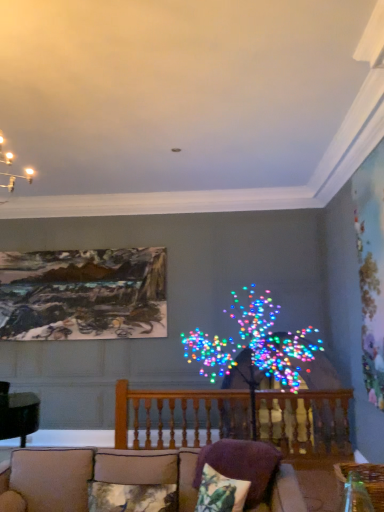
This screenshot has height=512, width=384. Describe the element at coordinates (131, 497) in the screenshot. I see `fluffy fabric pillow at lower center, marked as the third pillow in a right-to-left arrangement` at that location.

Locate an element on the screen. Image resolution: width=384 pixels, height=512 pixels. purple fabric pillow at lower center, which is the 3th pillow in left-to-right order is located at coordinates (241, 464).

Measure the distance between purple fabric pillow at lower center, the 1th pillow from the right, and camera.

purple fabric pillow at lower center, the 1th pillow from the right, and camera are 8.96 feet apart.

Identify the location of floral fabric pillow at lower center, placed as the 2th pillow when sorted from right to left. (220, 492).

This screenshot has width=384, height=512. Describe the element at coordinates (179, 417) in the screenshot. I see `wooden railing at center` at that location.

In order to face oil painting at upper left, should I rotate leftwards or rightwards?

Rotate your view left by about 14.771°.

The height and width of the screenshot is (512, 384). What do you see at coordinates (83, 294) in the screenshot?
I see `oil painting at upper left` at bounding box center [83, 294].

At what (x,y) coordinates should I click in order to perform the action: click on beige fabric couch at lower center. Please return your answer as a coordinate pair (x, y). Looking at the image, I should click on (94, 474).

Does point (215, 493) come farther from viewer compared to point (68, 472)?

No, it is in front of (68, 472).

Would you say floral fabric pillow at lower center, placed as the 2th pillow when sorted from right to left, is inside or outside beige fabric couch at lower center?

floral fabric pillow at lower center, placed as the 2th pillow when sorted from right to left, is enclosed within beige fabric couch at lower center.

Is floral fabric pillow at lower center, placed as the 2th pillow when sorted from right to left, touching beige fabric couch at lower center?

floral fabric pillow at lower center, placed as the 2th pillow when sorted from right to left, and beige fabric couch at lower center are clearly separated.

Does floral fabric pillow at lower center, placed as the 2th pillow when sorted from right to left, have a smaller size compared to purple fabric pillow at lower center, which is the 3th pillow in left-to-right order?

Indeed, floral fabric pillow at lower center, placed as the 2th pillow when sorted from right to left, has a smaller size compared to purple fabric pillow at lower center, which is the 3th pillow in left-to-right order.

Considering the sizes of objects floral fabric pillow at lower center, the 2th pillow when ordered from left to right, and purple fabric pillow at lower center, the 1th pillow from the right, in the image provided, who is taller, floral fabric pillow at lower center, the 2th pillow when ordered from left to right, or purple fabric pillow at lower center, the 1th pillow from the right,?

purple fabric pillow at lower center, the 1th pillow from the right, is taller.

Considering the sizes of floral fabric pillow at lower center, placed as the 2th pillow when sorted from right to left, and purple fabric pillow at lower center, which is the 3th pillow in left-to-right order, in the image, is floral fabric pillow at lower center, placed as the 2th pillow when sorted from right to left, wider or thinner than purple fabric pillow at lower center, which is the 3th pillow in left-to-right order,?

Clearly, floral fabric pillow at lower center, placed as the 2th pillow when sorted from right to left, has less width compared to purple fabric pillow at lower center, which is the 3th pillow in left-to-right order.

Which pillow is the 2nd one when counting from the back of the beige fabric couch at lower center? Please provide its 2D coordinates.

[(241, 464)]

From the image's perspective, is purple fabric pillow at lower center, the 1th pillow from the right, located above beige fabric couch at lower center?

Yes, from the image's perspective, purple fabric pillow at lower center, the 1th pillow from the right, is over beige fabric couch at lower center.

Does wooden railing at center have a lesser height compared to fluffy fabric pillow at lower center, marked as the third pillow in a right-to-left arrangement?

No, wooden railing at center is not shorter than fluffy fabric pillow at lower center, marked as the third pillow in a right-to-left arrangement.

Looking at this image, which of these two, wooden railing at center or fluffy fabric pillow at lower center, marked as the third pillow in a right-to-left arrangement, is smaller?

Smaller between the two is fluffy fabric pillow at lower center, marked as the third pillow in a right-to-left arrangement.

Consider the image. From a real-world perspective, is wooden railing at center physically below fluffy fabric pillow at lower center, which ranks as the 1th pillow in left-to-right order?

Incorrect, from a real-world perspective, wooden railing at center is higher than fluffy fabric pillow at lower center, which ranks as the 1th pillow in left-to-right order.

Does wooden railing at center turn towards fluffy fabric pillow at lower center, marked as the third pillow in a right-to-left arrangement?

Yes.

Which is more to the left, wooden railing at center or beige fabric couch at lower center?

beige fabric couch at lower center is more to the left.

In the scene shown: Is wooden railing at center bigger or smaller than beige fabric couch at lower center?

wooden railing at center is smaller than beige fabric couch at lower center.

Is wooden railing at center completely or partially outside of beige fabric couch at lower center?

Yes, wooden railing at center is outside of beige fabric couch at lower center.

Is point (269, 447) closer or farther from the camera than point (244, 498)?

Point (269, 447) appears to be farther away from the viewer than point (244, 498).

Between purple fabric pillow at lower center, the 1th pillow from the right, and floral fabric pillow at lower center, placed as the 2th pillow when sorted from right to left, which one is positioned in front?

Positioned in front is floral fabric pillow at lower center, placed as the 2th pillow when sorted from right to left.

Consider the image. Considering the relative sizes of purple fabric pillow at lower center, which is the 3th pillow in left-to-right order, and floral fabric pillow at lower center, placed as the 2th pillow when sorted from right to left, in the image provided, is purple fabric pillow at lower center, which is the 3th pillow in left-to-right order, bigger than floral fabric pillow at lower center, placed as the 2th pillow when sorted from right to left,?

Correct, purple fabric pillow at lower center, which is the 3th pillow in left-to-right order, is larger in size than floral fabric pillow at lower center, placed as the 2th pillow when sorted from right to left.

How many degrees apart are the facing directions of purple fabric pillow at lower center, the 1th pillow from the right, and floral fabric pillow at lower center, the 2th pillow when ordered from left to right?

They differ by 15.2 degrees in their facing directions.

Considering the relative sizes of floral fabric pillow at lower center, placed as the 2th pillow when sorted from right to left, and fluffy fabric pillow at lower center, marked as the third pillow in a right-to-left arrangement, in the image provided, is floral fabric pillow at lower center, placed as the 2th pillow when sorted from right to left, taller than fluffy fabric pillow at lower center, marked as the third pillow in a right-to-left arrangement,?

Correct, floral fabric pillow at lower center, placed as the 2th pillow when sorted from right to left, is much taller as fluffy fabric pillow at lower center, marked as the third pillow in a right-to-left arrangement.

Considering the relative positions of floral fabric pillow at lower center, the 2th pillow when ordered from left to right, and fluffy fabric pillow at lower center, which ranks as the 1th pillow in left-to-right order, in the image provided, is floral fabric pillow at lower center, the 2th pillow when ordered from left to right, to the right of fluffy fabric pillow at lower center, which ranks as the 1th pillow in left-to-right order, from the viewer's perspective?

Indeed, floral fabric pillow at lower center, the 2th pillow when ordered from left to right, is positioned on the right side of fluffy fabric pillow at lower center, which ranks as the 1th pillow in left-to-right order.

Which is less distant, (x=234, y=487) or (x=103, y=510)?

Positioned in front is point (x=234, y=487).

I want to click on pillow that is the 2nd one when counting upward from the beige fabric couch at lower center (from the image's perspective), so click(x=220, y=492).

From a real-world perspective, count 1st pillows downward from the purple fabric pillow at lower center, which is the 3th pillow in left-to-right order, and point to it. Please provide its 2D coordinates.

[(220, 492)]

Which object lies nearer to the anchor point purple fabric pillow at lower center, the 1th pillow from the right, floral fabric pillow at lower center, the 2th pillow when ordered from left to right, or beige fabric couch at lower center?

floral fabric pillow at lower center, the 2th pillow when ordered from left to right, is closer to purple fabric pillow at lower center, the 1th pillow from the right.

Which object lies nearer to the anchor point wooden railing at center, beige fabric couch at lower center or oil painting at upper left?

beige fabric couch at lower center is positioned closer to the anchor wooden railing at center.

When comparing their distances from oil painting at upper left, does purple fabric pillow at lower center, which is the 3th pillow in left-to-right order, or wooden railing at center seem closer?

The object closer to oil painting at upper left is wooden railing at center.

From the image, which object appears to be farther from beige fabric couch at lower center, oil painting at upper left or floral fabric pillow at lower center, the 2th pillow when ordered from left to right?

The object further to beige fabric couch at lower center is oil painting at upper left.

Estimate the real-world distances between objects in this image. Which object is closer to oil painting at upper left, beige fabric couch at lower center or fluffy fabric pillow at lower center, which ranks as the 1th pillow in left-to-right order?

beige fabric couch at lower center.

Consider the image. Which object lies further to the anchor point wooden railing at center, purple fabric pillow at lower center, which is the 3th pillow in left-to-right order, or fluffy fabric pillow at lower center, marked as the third pillow in a right-to-left arrangement?

Based on the image, fluffy fabric pillow at lower center, marked as the third pillow in a right-to-left arrangement, appears to be further to wooden railing at center.

Estimate the real-world distances between objects in this image. Which object is further from floral fabric pillow at lower center, the 2th pillow when ordered from left to right, purple fabric pillow at lower center, which is the 3th pillow in left-to-right order, or beige fabric couch at lower center?

The object further to floral fabric pillow at lower center, the 2th pillow when ordered from left to right, is beige fabric couch at lower center.

Based on their spatial positions, is fluffy fabric pillow at lower center, which ranks as the 1th pillow in left-to-right order, or beige fabric couch at lower center closer to oil painting at upper left?

beige fabric couch at lower center lies closer to oil painting at upper left than the other object.

You are a GUI agent. You are given a task and a screenshot of the screen. Output one action in this format:
    pyautogui.click(x=<x>, y=<y>)
    Task: Click on the balcony between fluffy fabric pillow at lower center, which ranks as the 1th pillow in left-to-right order, and oil painting at upper left in the front-back direction
    This screenshot has width=384, height=512.
    Given the screenshot: What is the action you would take?
    pyautogui.click(x=179, y=417)

At what (x,y) coordinates should I click in order to perform the action: click on pillow situated between fluffy fabric pillow at lower center, marked as the third pillow in a right-to-left arrangement, and purple fabric pillow at lower center, which is the 3th pillow in left-to-right order, from left to right. Please return your answer as a coordinate pair (x, y). Image resolution: width=384 pixels, height=512 pixels. Looking at the image, I should click on (220, 492).

Where is `pillow between purple fabric pillow at lower center, which is the 3th pillow in left-to-right order, and oil painting at upper left in the front-back direction`? The height and width of the screenshot is (512, 384). pillow between purple fabric pillow at lower center, which is the 3th pillow in left-to-right order, and oil painting at upper left in the front-back direction is located at coordinates pos(131,497).

Locate an element on the screen. Image resolution: width=384 pixels, height=512 pixels. pillow positioned between purple fabric pillow at lower center, the 1th pillow from the right, and wooden railing at center from near to far is located at coordinates (131, 497).